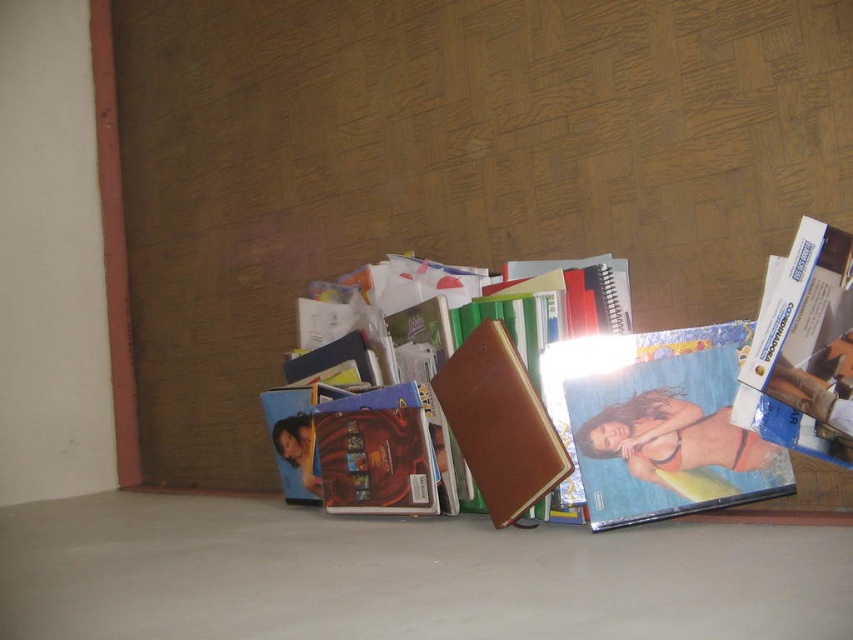
You are organizing the items on the floor and need to place the brown leather wallet at center and the blue glossy book at center into a drawer that can only hold items within 40 centimeters in length. Can both items fit side by side in the drawer without overlapping?

The distance between the brown leather wallet at center and the blue glossy book at center is 47.35 centimeters. Since the drawer can only accommodate items up to 40 centimeters in length, placing them side by side would exceed the drawer capacity. Therefore, they cannot fit together without overlapping.

You are standing 5 feet away from the wall. You see a matte plastic photo at center. Can you reach it without moving your feet?

The matte plastic photo at center is 4.49 feet away from the viewer. Since you are standing 5 feet away from the wall, the photo is slightly closer to you than the wall. However, reaching it without moving your feet may depend on your arm length. If your arm can extend about 0.5 feet or more, you might be able to reach it. Otherwise, you might need to take a small step forward.

You are organizing a bookshelf and need to place the matte plastic photo at center and the matte brown book at center. Since the photo is above the book in the current arrangement, does this mean the photo is physically resting on top of the book?

Yes, the matte plastic photo at center is above the matte brown book at center, so it is resting on top of the book in the current arrangement.